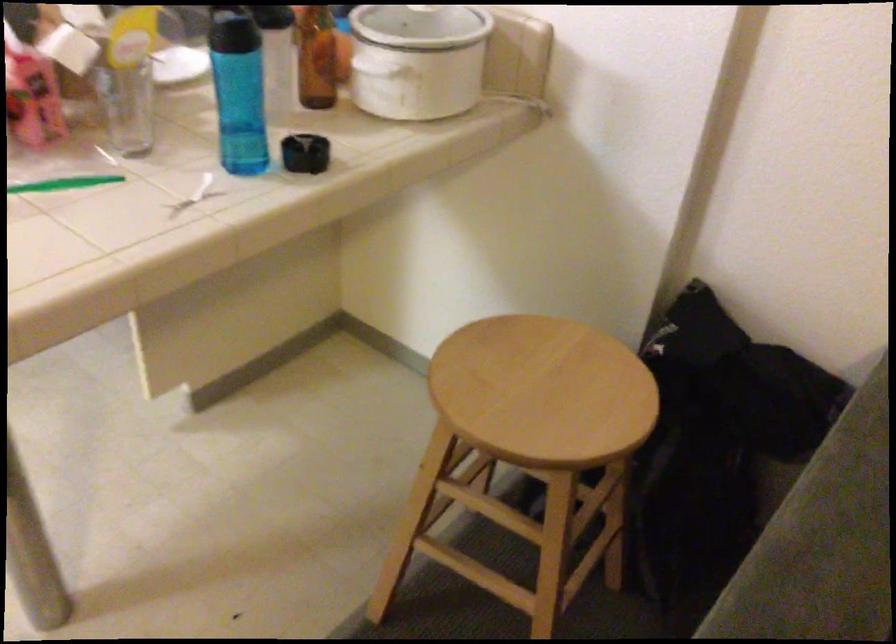
The image size is (896, 644). What are the coordinates of `brown glass bottle` in the screenshot? It's located at (315, 59).